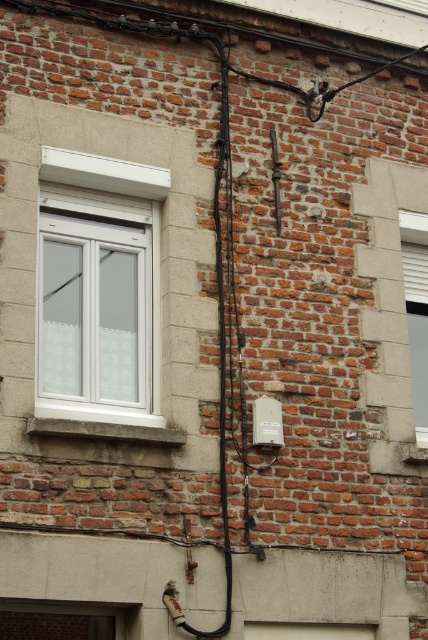
Does white plastic window at upper left have a larger size compared to white textured window at right?

Yes.

Image resolution: width=428 pixels, height=640 pixels. Find the location of `white plastic window at upper left`. white plastic window at upper left is located at coordinates (98, 289).